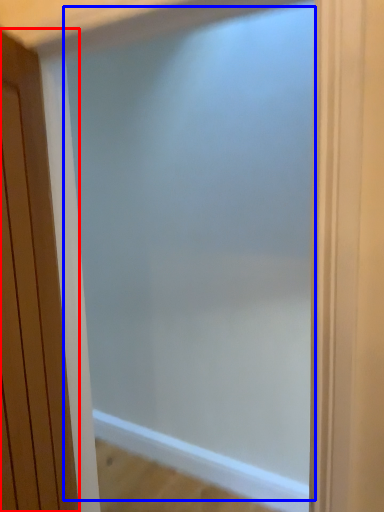
Question: Which object is further to the camera taking this photo, door (highlighted by a red box) or screen door (highlighted by a blue box)?

Choices:
 (A) door
 (B) screen door

Answer: (B)